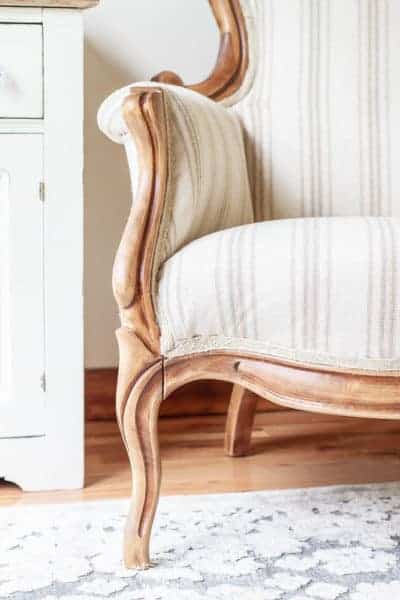
Locate an element on the screen. arm rest is located at coordinates (177, 103).